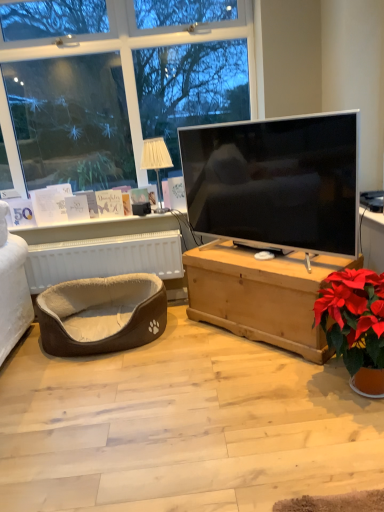
Identify the location of vacant space in front of brown plush pet bed at lower left. (97, 393).